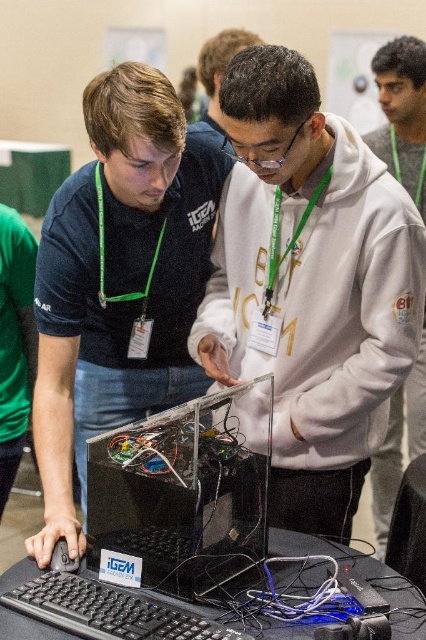
Question: Which object is positioned closest to the transparent plastic computer at center?

Choices:
 (A) black plastic keyboard at lower left
 (B) white fleece hoodie at center
 (C) white matte hoodie at center

Answer: (A)

Question: Which of these objects is positioned closest to the black plastic keyboard at lower left?

Choices:
 (A) transparent plastic computer at center
 (B) matte black shirt at left
 (C) white matte hoodie at center
 (D) white fleece hoodie at center

Answer: (A)

Question: Where is white fleece hoodie at center located in relation to black plastic keyboard at lower left in the image?

Choices:
 (A) right
 (B) left

Answer: (A)

Question: Can you confirm if white fleece hoodie at center is smaller than black plastic keyboard at lower left?

Choices:
 (A) no
 (B) yes

Answer: (A)

Question: Can you confirm if white matte hoodie at center is positioned to the left of transparent plastic computer at center?

Choices:
 (A) no
 (B) yes

Answer: (A)

Question: Which point appears closest to the camera in this image?

Choices:
 (A) (199, 240)
 (B) (385, 182)

Answer: (B)